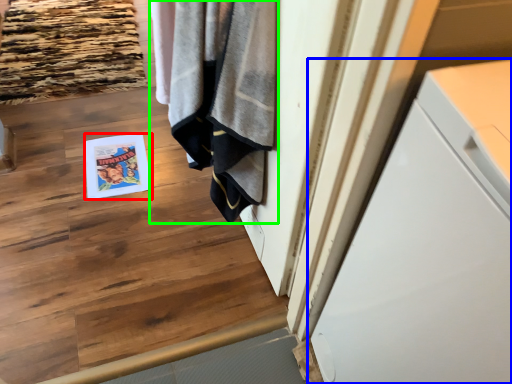
Question: Estimate the real-world distances between objects in this image. Which object is farther from magazine (highlighted by a red box), cabinetry (highlighted by a blue box) or bath towel (highlighted by a green box)?

Choices:
 (A) cabinetry
 (B) bath towel

Answer: (A)